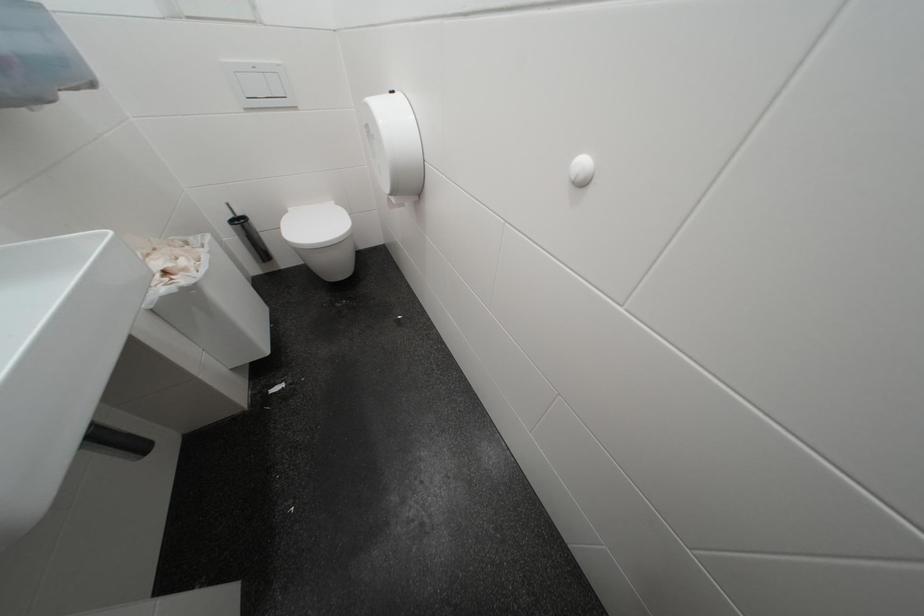
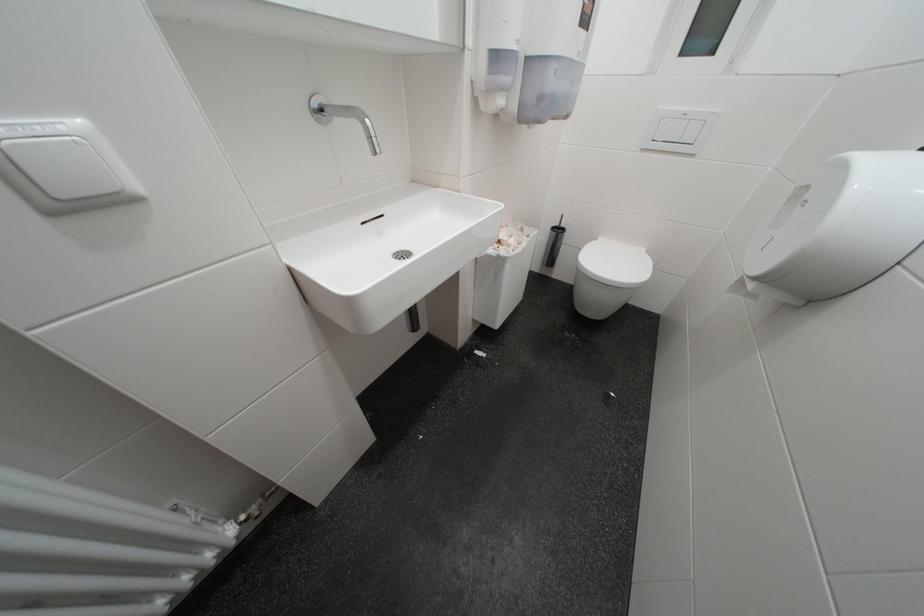
Question: The first image is from the beginning of the video and the second image is from the end. How did the camera likely rotate when shooting the video?

Choices:
 (A) Left
 (B) Right
 (C) Up
 (D) Down

Answer: (A)